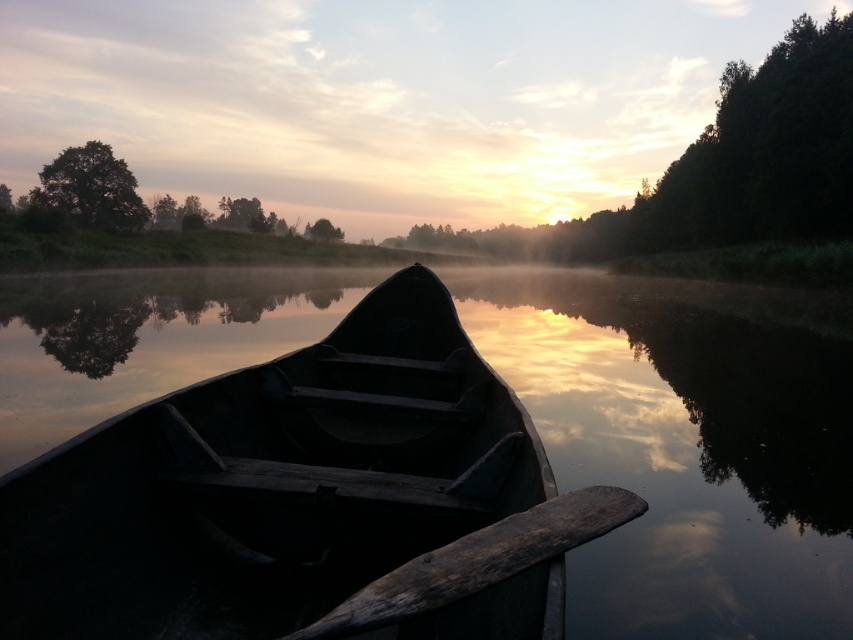
You are an observer standing on the shore looking at the dark wood boat at center and the green matte tree at upper center. Which object is closer to your right side?

The dark wood boat at center is positioned on the right side of green matte tree at upper center, so from your perspective on the shore, the dark wood boat at center would be to your right.

You are an observer standing on the shore looking at the dark wood boat at center and the green leafy tree at upper left. Which object is closer to you?

The dark wood boat at center is closer to you because it is positioned in front of the green leafy tree at upper left.

You are a kayaker who needs to reach the dark wood boat at center to retrieve the dark brown wooden paddle at center. Given that your kayak is 1.2 meters wide, can you safely maneuver between them?

The distance between the dark wood boat at center and the dark brown wooden paddle at center is 1.37 meters. Since your kayak is 1.2 meters wide, you can safely maneuver between them as the space is wider than your kayak.